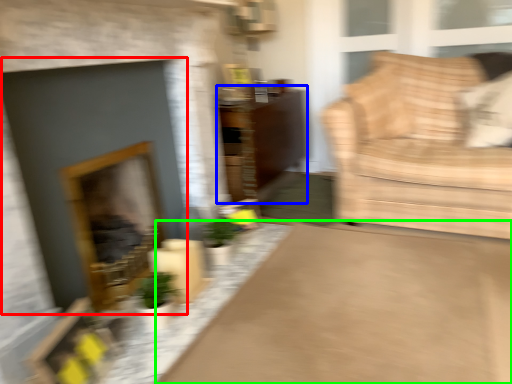
Question: Which is farther away from fireplace (highlighted by a red box)? dresser (highlighted by a blue box) or plain (highlighted by a green box)?

Choices:
 (A) dresser
 (B) plain

Answer: (A)